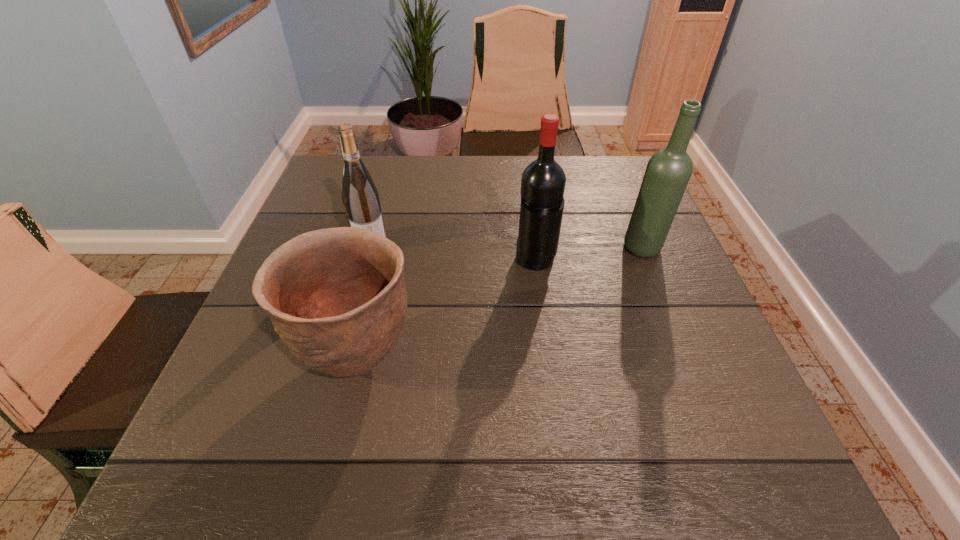
The image size is (960, 540). I want to click on free space between the shortest object and the second object from right to left, so click(446, 310).

You are a GUI agent. You are given a task and a screenshot of the screen. Output one action in this format:
    pyautogui.click(x=<x>, y=<y>)
    Task: Click on the free space between the second object from right to left and the pottery
    
    Given the screenshot: What is the action you would take?
    pyautogui.click(x=446, y=310)

The image size is (960, 540). I want to click on free spot between the rightmost wine bottle and the shortest object, so click(500, 303).

I want to click on free space between the rightmost wine bottle and the pottery, so click(x=500, y=303).

You are a GUI agent. You are given a task and a screenshot of the screen. Output one action in this format:
    pyautogui.click(x=<x>, y=<y>)
    Task: Click on the unoccupied area between the shortest object and the rightmost object
    The height and width of the screenshot is (540, 960).
    Given the screenshot: What is the action you would take?
    pyautogui.click(x=500, y=303)

The width and height of the screenshot is (960, 540). What are the coordinates of `free spot between the third tallest object and the rightmost wine bottle` in the screenshot? It's located at (507, 246).

You are a GUI agent. You are given a task and a screenshot of the screen. Output one action in this format:
    pyautogui.click(x=<x>, y=<y>)
    Task: Click on the free space between the nearest object and the second object from right to left
    
    Given the screenshot: What is the action you would take?
    pyautogui.click(x=446, y=310)

Where is `object that is the second closest to the second wine bottle from right to left`? object that is the second closest to the second wine bottle from right to left is located at coordinates 337,298.

Identify which object is located as the nearest to the second object from right to left. Please provide its 2D coordinates. Your answer should be formatted as a tuple, i.e. [(x, y)], where the tuple contains the x and y coordinates of a point satisfying the conditions above.

[(668, 171)]

Choose which wine bottle is the second nearest neighbor to the nearest object. Please provide its 2D coordinates. Your answer should be formatted as a tuple, i.e. [(x, y)], where the tuple contains the x and y coordinates of a point satisfying the conditions above.

[(543, 181)]